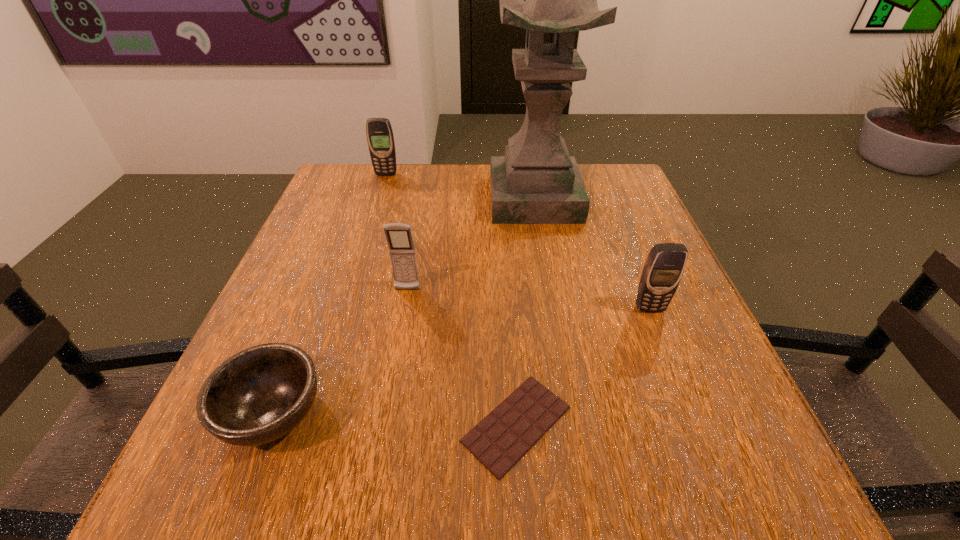
Identify the location of free area in between the tallest object and the bowl. (404, 306).

Where is `free point between the third nearest object and the fourth nearest object`? free point between the third nearest object and the fourth nearest object is located at coordinates (528, 299).

The width and height of the screenshot is (960, 540). Find the location of `free point between the farthest object and the bowl`. free point between the farthest object and the bowl is located at coordinates (329, 294).

Locate an element on the screen. This screenshot has height=540, width=960. object identified as the closest to the rightmost cellular telephone is located at coordinates (498, 441).

Where is `object that can be found as the second closest to the farthest object`? The width and height of the screenshot is (960, 540). object that can be found as the second closest to the farthest object is located at coordinates (399, 237).

Identify which cellular telephone is the second nearest to the second cellular telephone from right to left. Please provide its 2D coordinates. Your answer should be formatted as a tuple, i.e. [(x, y)], where the tuple contains the x and y coordinates of a point satisfying the conditions above.

[(380, 138)]

Where is `cellular telephone identified as the closest to the fifth tallest object`? cellular telephone identified as the closest to the fifth tallest object is located at coordinates (399, 237).